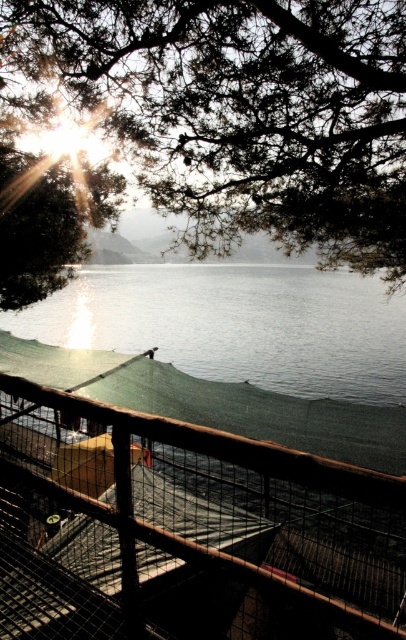
Which of these two, brown wooden fence at lower center or green leafy tree at upper center, stands shorter?

brown wooden fence at lower center

Who is taller, brown wooden fence at lower center or green leafy tree at upper center?

Standing taller between the two is green leafy tree at upper center.

Identify the location of brown wooden fence at lower center. This screenshot has height=640, width=406. (185, 531).